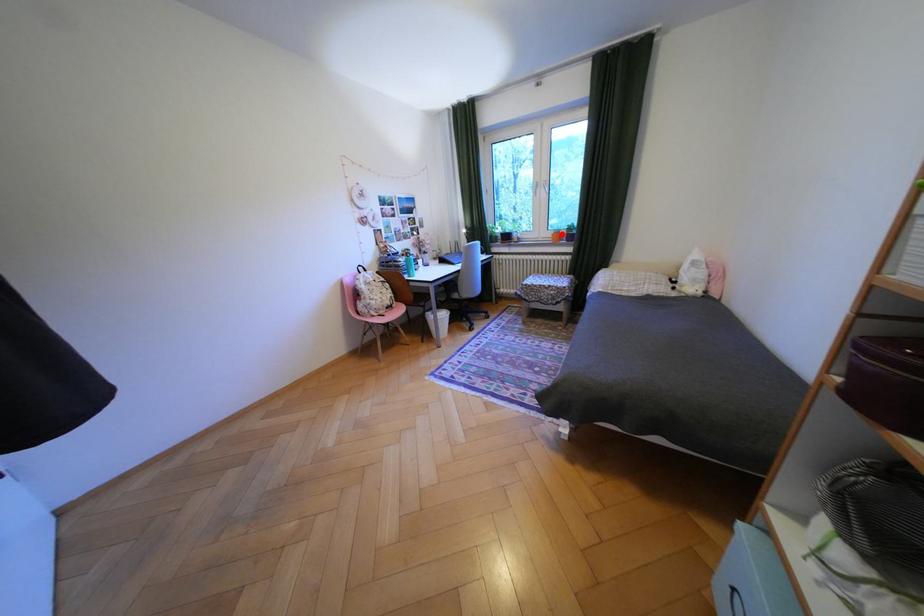
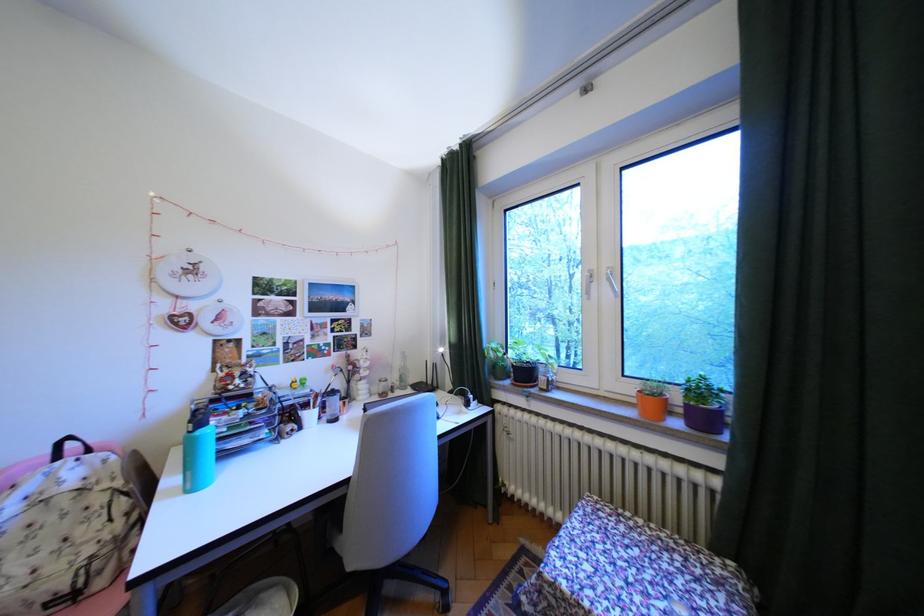
Locate, in the second image, the point that corresponds to the highlighted location in the first image.

(641, 390)